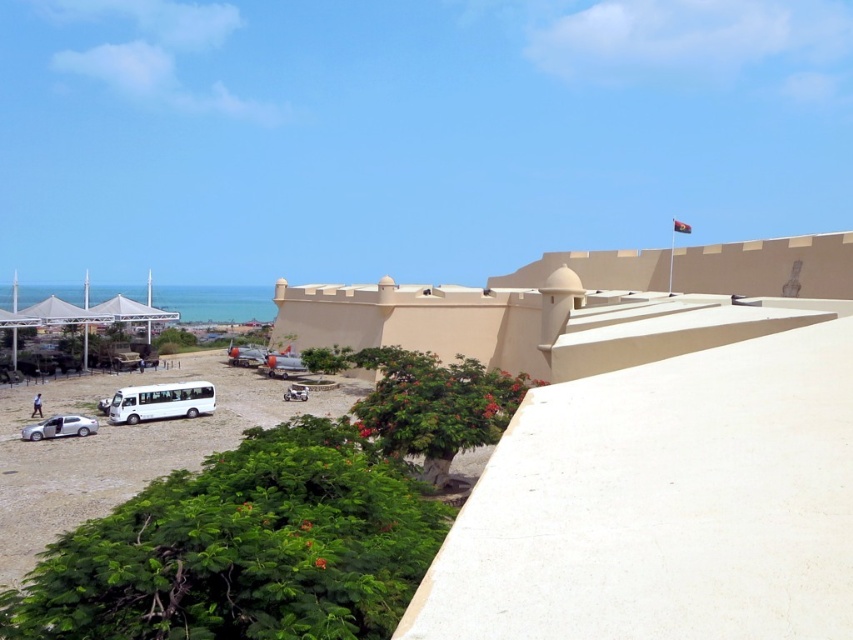
Question: Is the position of white sand beach at lower left less distant than that of white matte van at lower left?

Choices:
 (A) yes
 (B) no

Answer: (A)

Question: Does white sand beach at lower left have a larger size compared to white matte van at lower left?

Choices:
 (A) no
 (B) yes

Answer: (B)

Question: Can you confirm if white matte van at lower left is wider than silver metallic car at lower left?

Choices:
 (A) no
 (B) yes

Answer: (B)

Question: Which of the following is the farthest from the observer?

Choices:
 (A) (62, 428)
 (B) (196, 413)

Answer: (B)

Question: Which point is closer to the camera taking this photo?

Choices:
 (A) (254, 412)
 (B) (155, 406)
 (C) (302, 385)

Answer: (B)

Question: Which of these objects is positioned closest to the white matte van at lower left?

Choices:
 (A) silver metallic car at lower left
 (B) white matte car at center

Answer: (A)